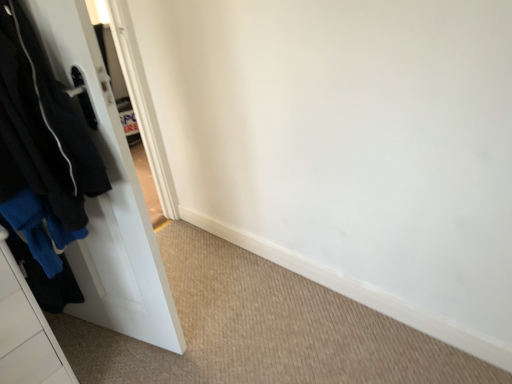
Question: Is black matte jacket at left behind white matte door at left?

Choices:
 (A) no
 (B) yes

Answer: (A)

Question: Does black matte jacket at left have a greater width compared to white matte door at left?

Choices:
 (A) yes
 (B) no

Answer: (A)

Question: Is black matte jacket at left with white matte door at left?

Choices:
 (A) no
 (B) yes

Answer: (A)

Question: Is black matte jacket at left not near white matte door at left?

Choices:
 (A) yes
 (B) no

Answer: (B)

Question: From a real-world perspective, is black matte jacket at left on top of white matte door at left?

Choices:
 (A) yes
 (B) no

Answer: (A)

Question: Is black matte jacket at left looking in the opposite direction of white matte door at left?

Choices:
 (A) no
 (B) yes

Answer: (B)

Question: Is white matte door at left thinner than black matte jacket at left?

Choices:
 (A) yes
 (B) no

Answer: (A)

Question: Considering the relative sizes of white matte door at left and black matte jacket at left in the image provided, is white matte door at left smaller than black matte jacket at left?

Choices:
 (A) no
 (B) yes

Answer: (A)

Question: Considering the relative sizes of white matte door at left and black matte jacket at left in the image provided, is white matte door at left bigger than black matte jacket at left?

Choices:
 (A) yes
 (B) no

Answer: (A)

Question: Is white matte door at left to the right of black matte jacket at left from the viewer's perspective?

Choices:
 (A) yes
 (B) no

Answer: (A)

Question: From a real-world perspective, is white matte door at left below black matte jacket at left?

Choices:
 (A) no
 (B) yes

Answer: (B)

Question: Is white matte door at left further to camera compared to black matte jacket at left?

Choices:
 (A) yes
 (B) no

Answer: (A)

Question: In the image, is black matte jacket at left on the left side or the right side of white matte door at left?

Choices:
 (A) right
 (B) left

Answer: (B)